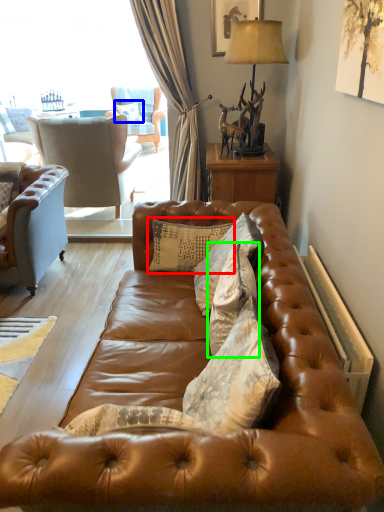
Question: Considering the real-world distances, which object is closest to pillow (highlighted by a red box)? pillow (highlighted by a blue box) or pillow (highlighted by a green box).

Choices:
 (A) pillow
 (B) pillow

Answer: (B)